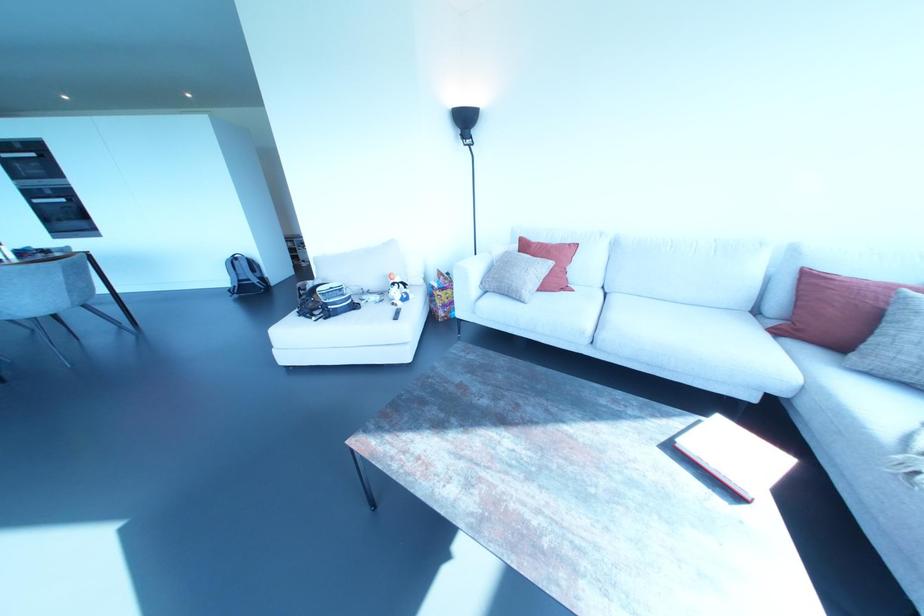
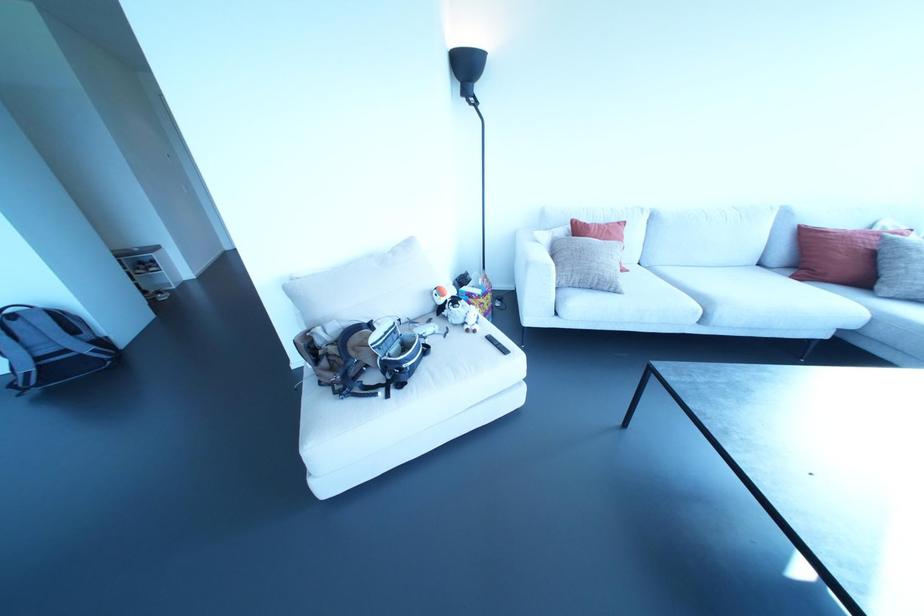
The point at (248, 278) is marked in the first image. Where is the corresponding point in the second image?

(65, 350)